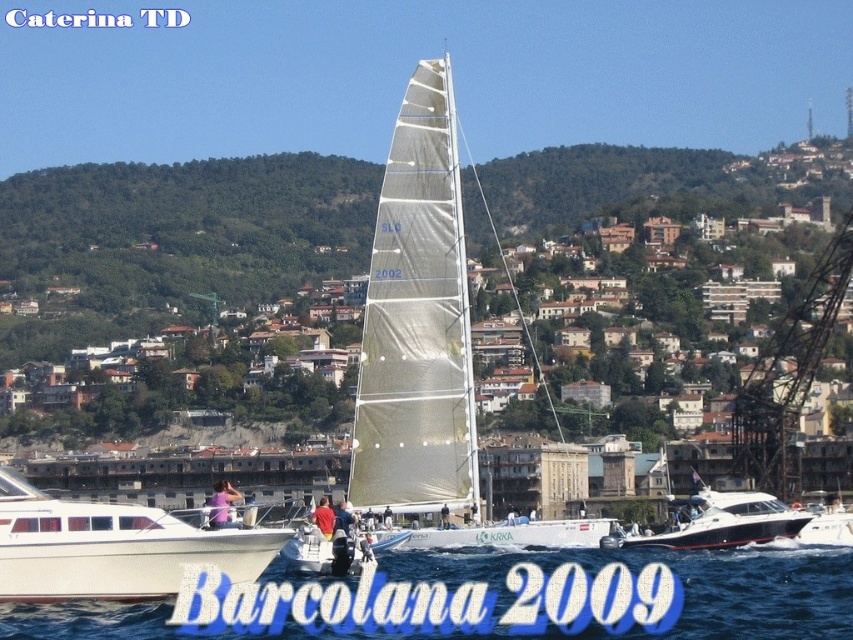
You are a sailor on the white glossy motorboat at center. You want to check the status of the transparent white sail at center. Which direction should you look to see it?

The transparent white sail at center is above the white glossy motorboat at center, so you should look upward to see it.

You are a photographer standing on the deck of the SLO 2002 sailboat during the Barcolana 2009 regatta. You notice the blue water at lower center and the blue fabric shirt at center in your viewfinder. Which object is closer to the camera based on their positions?

The blue fabric shirt at center is closer to the camera because the blue water at lower center is positioned over it, indicating it is further away.

Looking at this image, you are a photographer standing on the dock, and you want to take a photo of the pink fabric person at center and the white fabric sail at center. Which one appears larger in the photo?

The pink fabric person at center is taller than the white fabric sail at center, so the pink fabric person at center will appear larger in the photo.